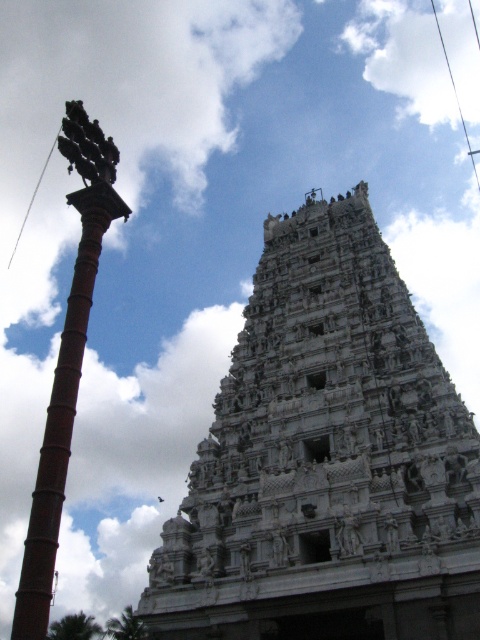
Question: Is white stone temple at center positioned at the back of brown brick pole at left?

Choices:
 (A) no
 (B) yes

Answer: (B)

Question: Can you confirm if white stone temple at center is smaller than brown brick pole at left?

Choices:
 (A) yes
 (B) no

Answer: (A)

Question: Is white stone temple at center wider than brown brick pole at left?

Choices:
 (A) yes
 (B) no

Answer: (B)